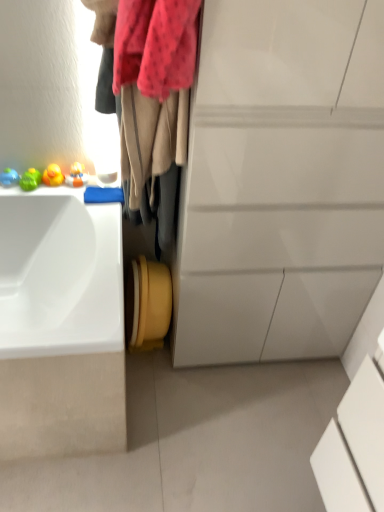
Question: Would you say white glossy sink at left contains white glossy cabinet at center?

Choices:
 (A) no
 (B) yes

Answer: (A)

Question: Is white glossy sink at left positioned in front of white glossy cabinet at center?

Choices:
 (A) no
 (B) yes

Answer: (A)

Question: Is white glossy sink at left wider than white glossy cabinet at center?

Choices:
 (A) yes
 (B) no

Answer: (A)

Question: Is the depth of white glossy sink at left greater than that of white glossy cabinet at center?

Choices:
 (A) no
 (B) yes

Answer: (B)

Question: Considering the relative sizes of white glossy sink at left and white glossy cabinet at center in the image provided, is white glossy sink at left bigger than white glossy cabinet at center?

Choices:
 (A) no
 (B) yes

Answer: (A)

Question: Does white glossy sink at left have a lesser height compared to white glossy cabinet at center?

Choices:
 (A) no
 (B) yes

Answer: (B)

Question: From a real-world perspective, is white glossy cabinet at center positioned under white glossy sink at left based on gravity?

Choices:
 (A) yes
 (B) no

Answer: (B)

Question: Can you confirm if white glossy cabinet at center is smaller than white glossy sink at left?

Choices:
 (A) no
 (B) yes

Answer: (A)

Question: Is white glossy cabinet at center bigger than white glossy sink at left?

Choices:
 (A) yes
 (B) no

Answer: (A)

Question: Is white glossy cabinet at center oriented away from white glossy sink at left?

Choices:
 (A) no
 (B) yes

Answer: (A)

Question: From the image's perspective, would you say white glossy cabinet at center is shown under white glossy sink at left?

Choices:
 (A) no
 (B) yes

Answer: (A)

Question: Is white glossy cabinet at center not inside white glossy sink at left?

Choices:
 (A) no
 (B) yes

Answer: (B)

Question: Is white glossy sink at left oriented towards velvet beige scarf at upper left?

Choices:
 (A) no
 (B) yes

Answer: (A)